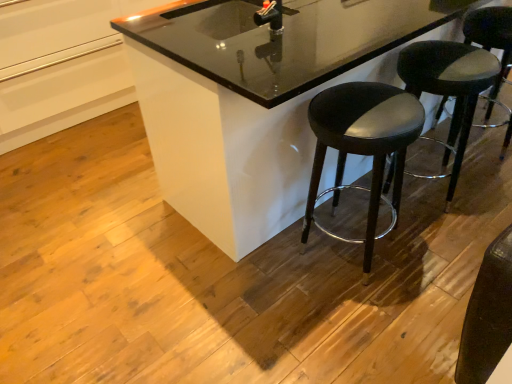
This screenshot has height=384, width=512. In order to click on free space below black leather stool at lower right, which is the second stool from right to left (from a real-world perspective) in this screenshot , I will do `click(429, 202)`.